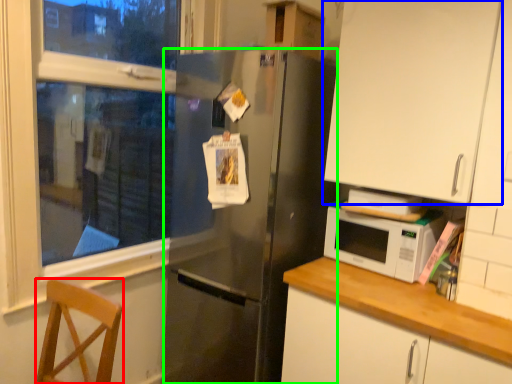
Question: Which object is the closest to the chair (highlighted by a red box)? Choose among these: cabinetry (highlighted by a blue box) or refrigerator (highlighted by a green box).

Choices:
 (A) cabinetry
 (B) refrigerator

Answer: (B)